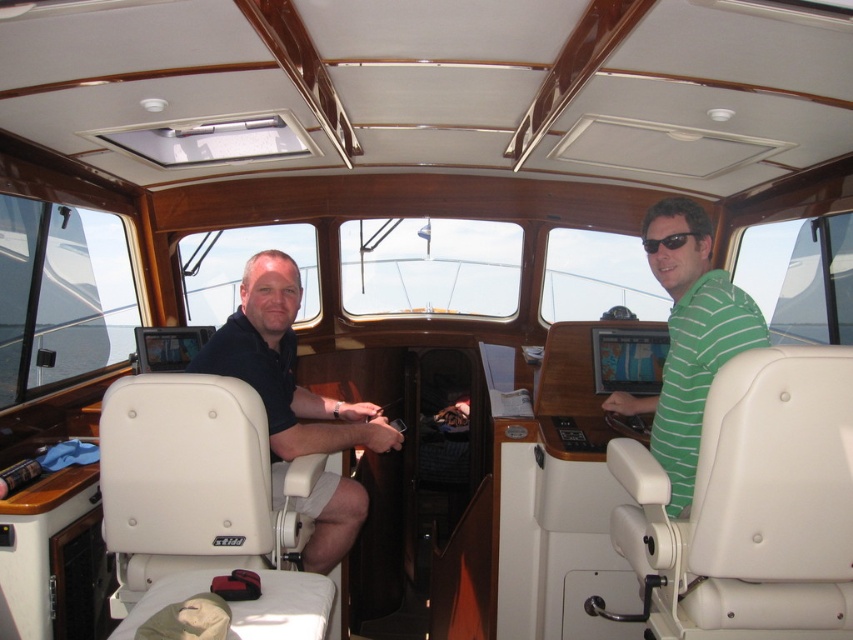
You are designing a new interior layout for the boat cockpit. The white leather seat at center and dark blue shirt at left are important elements. Which object is shorter in height?

The white leather seat at center is shorter in height than the dark blue shirt at left.

You are planning to bring a large backpack that requires 1.5 square feet of space. You see the white leather seat at center and the green striped shirt at right. Which object can accommodate your backpack?

The white leather seat at center is bigger than the green striped shirt at right, so the backpack can be placed on the white leather seat at center.